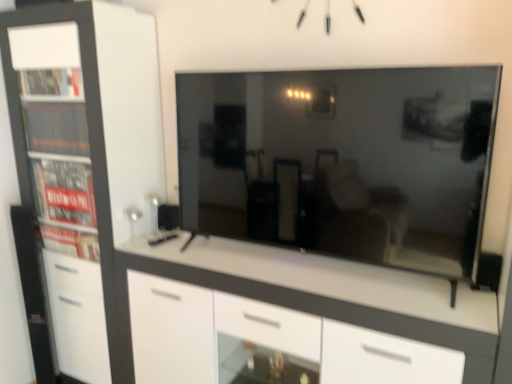
Locate an element on the screen. This screenshot has width=512, height=384. vacant space underneath matte black tv at center (from a real-world perspective) is located at coordinates (288, 263).